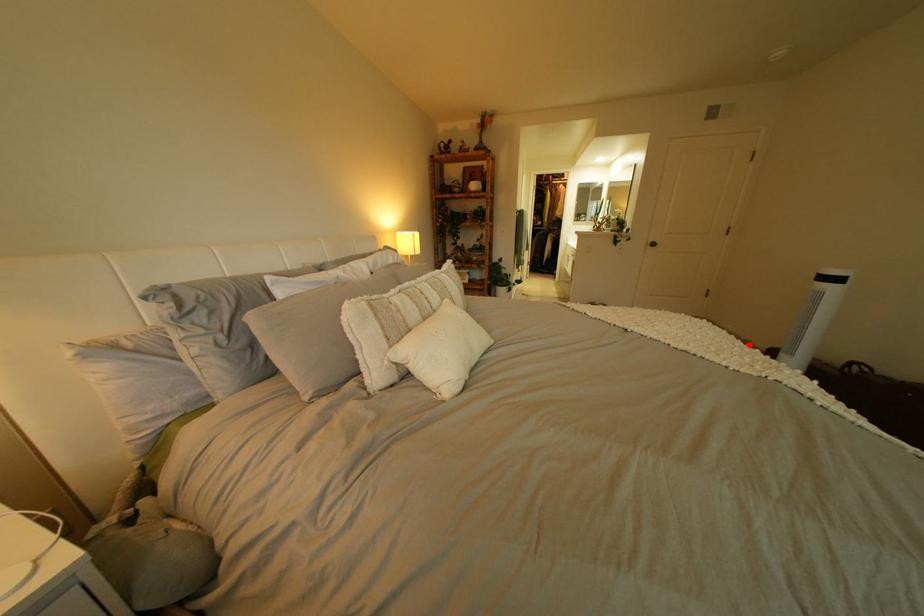
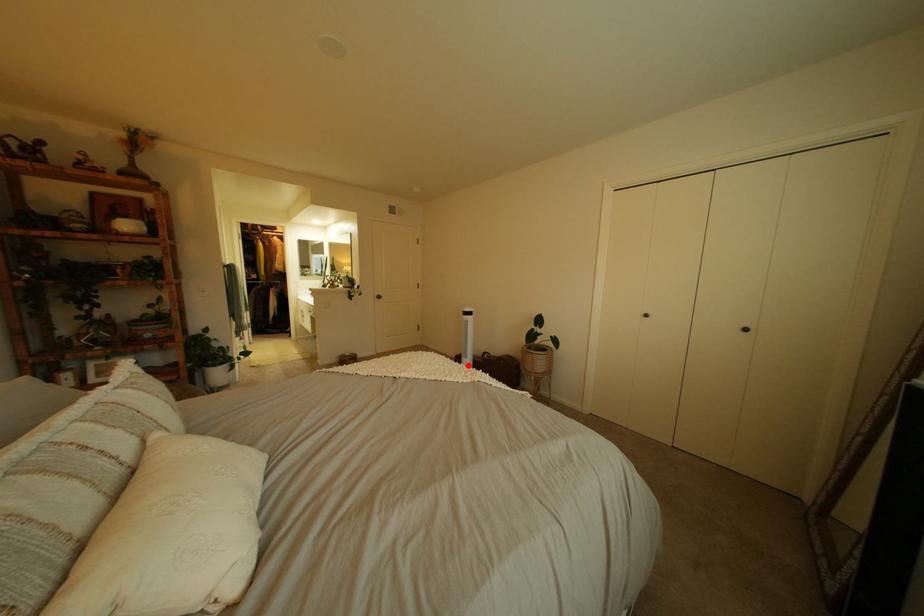
I am providing you with two images of the same scene from different viewpoints. A red point is marked on the first image and another point is marked on the second image. Does the point marked in image1 correspond to the same location as the one in image2?

Yes